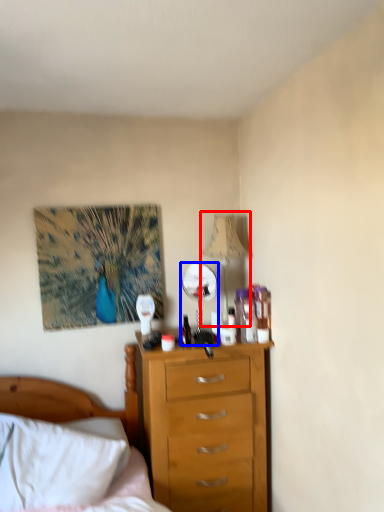
Question: Which object appears closest to the camera in this image, lamp (highlighted by a red box) or mirror (highlighted by a blue box)?

Choices:
 (A) lamp
 (B) mirror

Answer: (A)